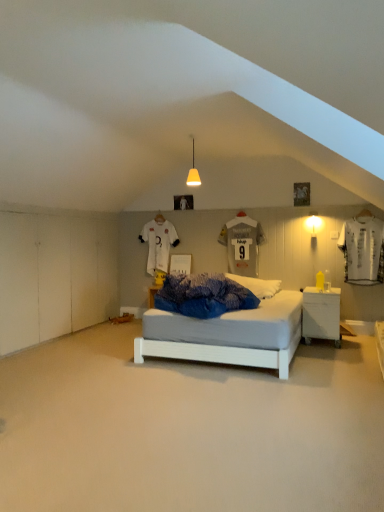
Where is `free space on the front side of white glossy nightstand at lower right`? free space on the front side of white glossy nightstand at lower right is located at coordinates (332, 347).